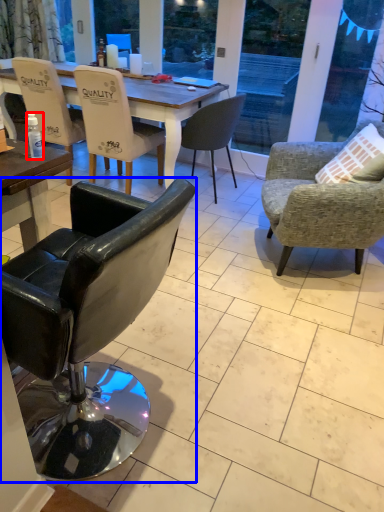
Question: Which object is closer to the camera taking this photo, bottle (highlighted by a red box) or chair (highlighted by a blue box)?

Choices:
 (A) bottle
 (B) chair

Answer: (B)